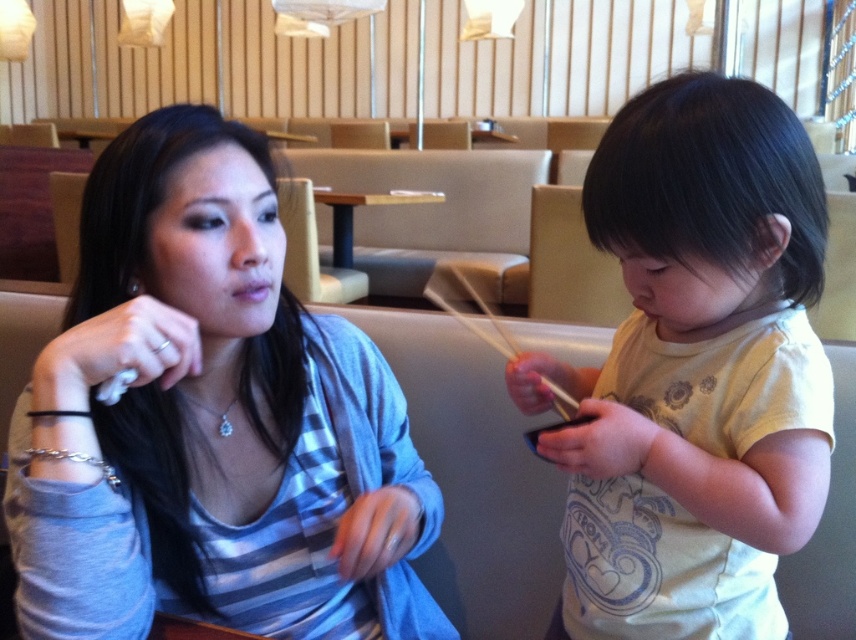
You are taking a photo of the scene and want to focus on both point [123,200] and point [551,387]. Since you can only focus on one point at a time, which point should you choose to ensure that the other point remains relatively in focus?

You should focus on point [123,200] because it is closer to the camera. In photography, focusing on the closer object increases the likelihood that the farther object will still be relatively in focus due to depth of field principles.

You are a server in the restaurant and need to place a 10 cm thick menu on the table. Can the wooden table at center support the menu if the menu is placed on top of the light yellow cotton shirt at right?

The light yellow cotton shirt at right is thinner than the wooden table at center, but the shirt is not designed to support weight. Therefore, placing the menu directly on the wooden table at center would be more stable and appropriate for supporting the menu.

You are standing at the entrance of the restaurant and see the point marked at coordinates (694,371). What object is located at that point?

The point at coordinates (694,371) corresponds to the light yellow cotton shirt at right.